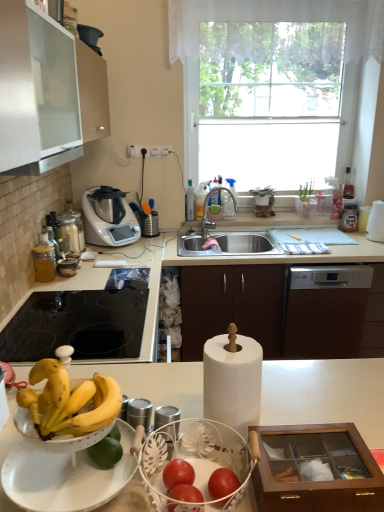
Locate an element on the screen. The image size is (384, 512). vacant space in front of metallic silver food processor at center-left is located at coordinates (122, 254).